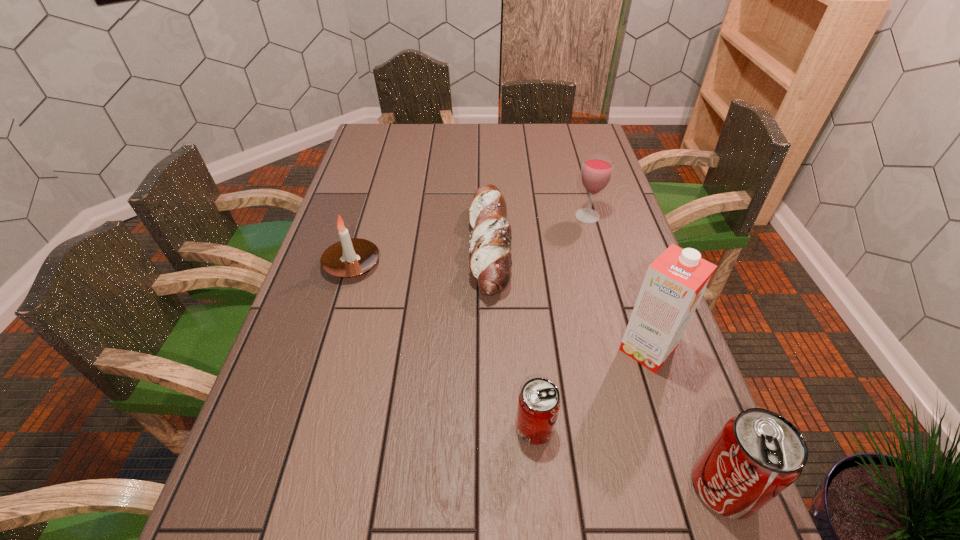
I want to click on object that is at the near right corner, so click(758, 453).

I want to click on free space at the far edge of the desktop, so click(496, 132).

You are a GUI agent. You are given a task and a screenshot of the screen. Output one action in this format:
    pyautogui.click(x=<x>, y=<y>)
    Task: Click on the vacant point at the left edge
    Image resolution: width=960 pixels, height=540 pixels.
    Given the screenshot: What is the action you would take?
    pyautogui.click(x=349, y=295)

At what (x,y) coordinates should I click in order to perform the action: click on vacant region at the right edge of the desktop. Please return your answer as a coordinate pair (x, y). The height and width of the screenshot is (540, 960). Looking at the image, I should click on (609, 210).

Where is `free space at the far left corner of the desktop`? The height and width of the screenshot is (540, 960). free space at the far left corner of the desktop is located at coordinates (377, 127).

At what (x,y) coordinates should I click in order to perform the action: click on vacant area that lies between the right pop soda and the fifth farthest object. Please return your answer as a coordinate pair (x, y). The height and width of the screenshot is (540, 960). Looking at the image, I should click on (629, 457).

Find the location of a particular element. Image resolution: width=960 pixels, height=540 pixels. free space between the tallest object and the left pop soda is located at coordinates (591, 389).

The width and height of the screenshot is (960, 540). What are the coordinates of `vacant area that lies between the left pop soda and the wineglass` in the screenshot? It's located at (561, 322).

Image resolution: width=960 pixels, height=540 pixels. Find the location of `empty space that is in between the candle and the third nearest object`. empty space that is in between the candle and the third nearest object is located at coordinates (499, 307).

Locate an element on the screen. empty location between the leftmost object and the right pop soda is located at coordinates (538, 376).